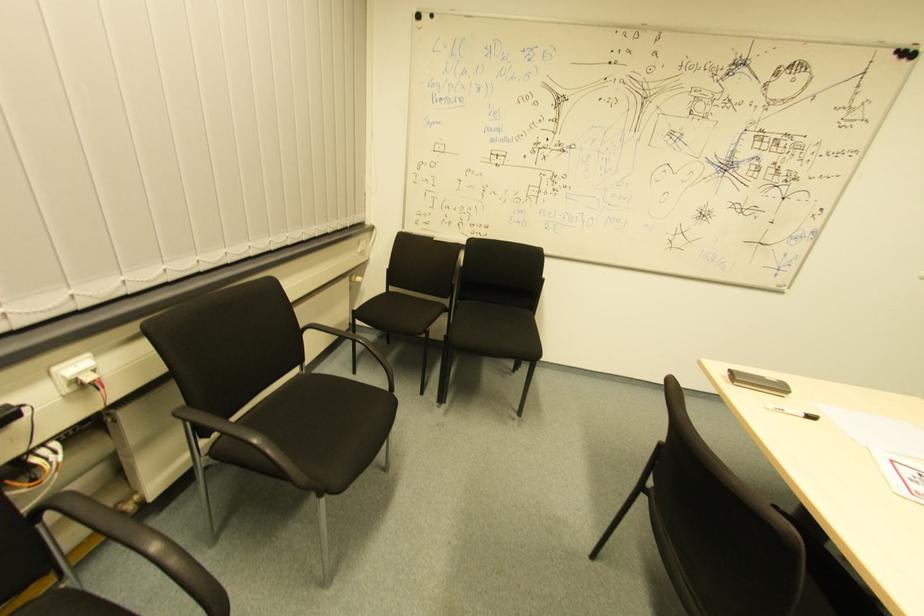
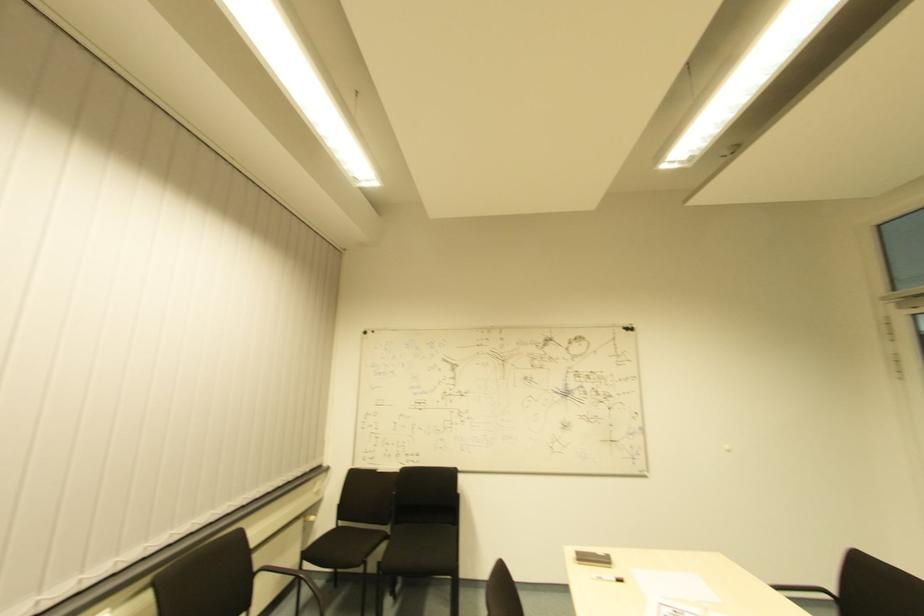
Question: The images are taken continuously from a first-person perspective. In which direction is your viewpoint rotating?

Choices:
 (A) Left
 (B) Right
 (C) Up
 (D) Down

Answer: (C)